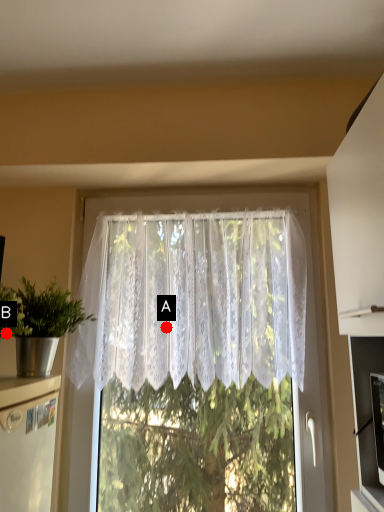
Question: Two points are circled on the image, labeled by A and B beside each circle. Which point appears closest to the camera in this image?

Choices:
 (A) A is closer
 (B) B is closer

Answer: (B)